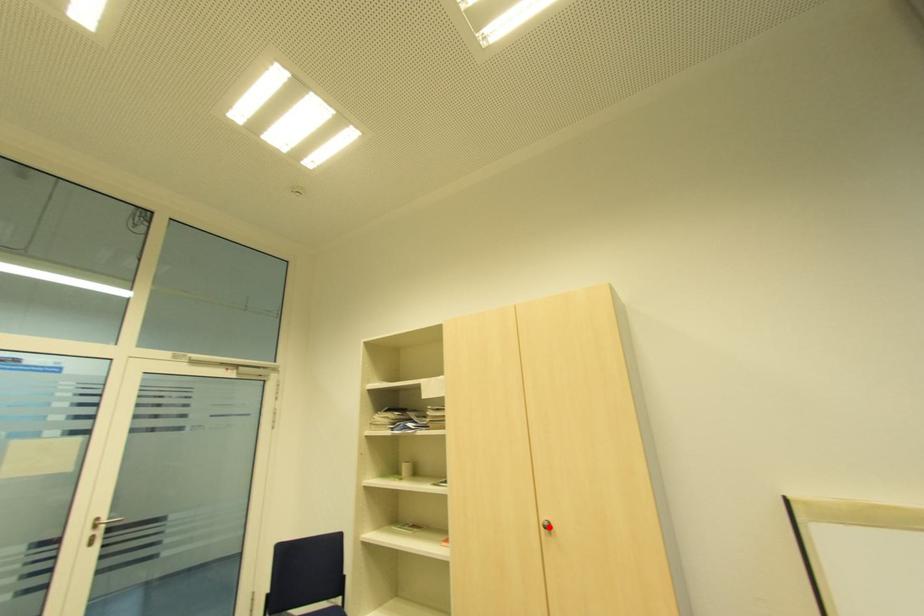
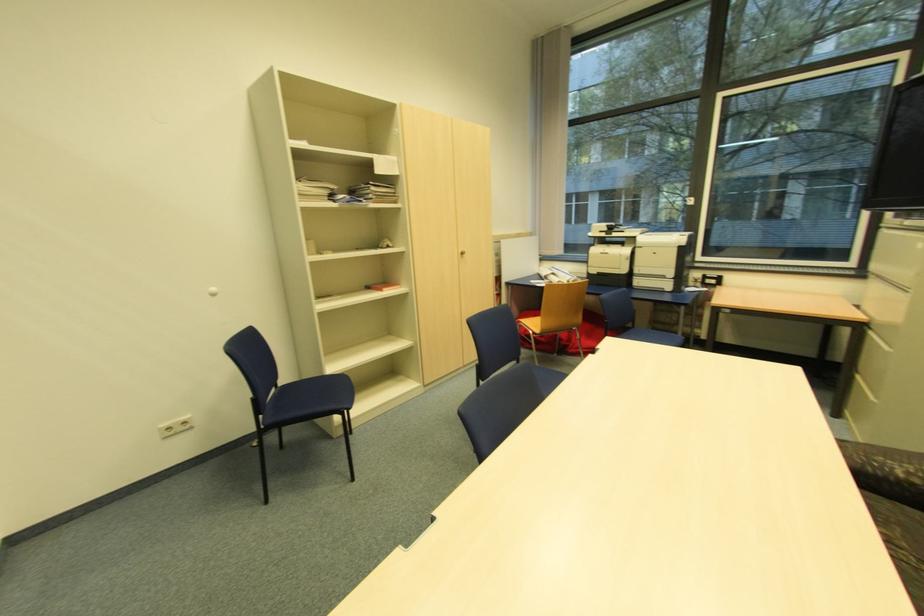
Find the pixel in the second image that matches the highlighted location in the first image.

(466, 254)